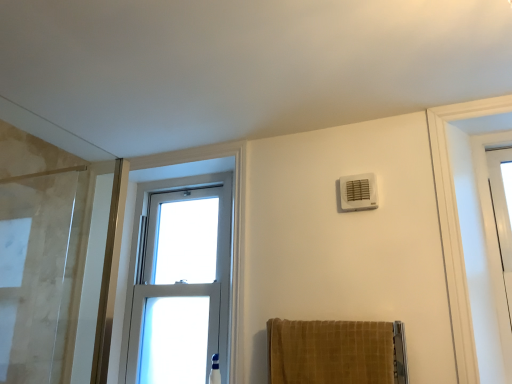
Question: Does clear glass window at center have a greater height compared to white plastic air conditioning unit at upper right?

Choices:
 (A) yes
 (B) no

Answer: (A)

Question: Can you confirm if clear glass window at center is bigger than white plastic air conditioning unit at upper right?

Choices:
 (A) yes
 (B) no

Answer: (A)

Question: Is white plastic air conditioning unit at upper right at the back of clear glass window at center?

Choices:
 (A) no
 (B) yes

Answer: (A)

Question: Is the depth of clear glass window at center greater than that of white plastic air conditioning unit at upper right?

Choices:
 (A) yes
 (B) no

Answer: (A)

Question: From the image's perspective, is clear glass window at center below white plastic air conditioning unit at upper right?

Choices:
 (A) yes
 (B) no

Answer: (A)

Question: From a real-world perspective, is clear glass window at center on top of white plastic air conditioning unit at upper right?

Choices:
 (A) yes
 (B) no

Answer: (B)

Question: Can we say white plastic air conditioning unit at upper right lies outside clear glass window at center?

Choices:
 (A) yes
 (B) no

Answer: (A)

Question: Is clear glass window at center a part of white plastic air conditioning unit at upper right?

Choices:
 (A) no
 (B) yes

Answer: (A)

Question: Considering the relative sizes of white plastic air conditioning unit at upper right and clear glass window at center in the image provided, is white plastic air conditioning unit at upper right shorter than clear glass window at center?

Choices:
 (A) no
 (B) yes

Answer: (B)

Question: Are white plastic air conditioning unit at upper right and clear glass window at center located far from each other?

Choices:
 (A) no
 (B) yes

Answer: (B)

Question: Can you confirm if white plastic air conditioning unit at upper right is positioned to the right of clear glass window at center?

Choices:
 (A) no
 (B) yes

Answer: (B)

Question: From a real-world perspective, is white plastic air conditioning unit at upper right under clear glass window at center?

Choices:
 (A) yes
 (B) no

Answer: (B)

Question: Considering the relative positions of clear glass window at center and velvet gold towel at lower center in the image provided, is clear glass window at center in front of velvet gold towel at lower center?

Choices:
 (A) no
 (B) yes

Answer: (A)